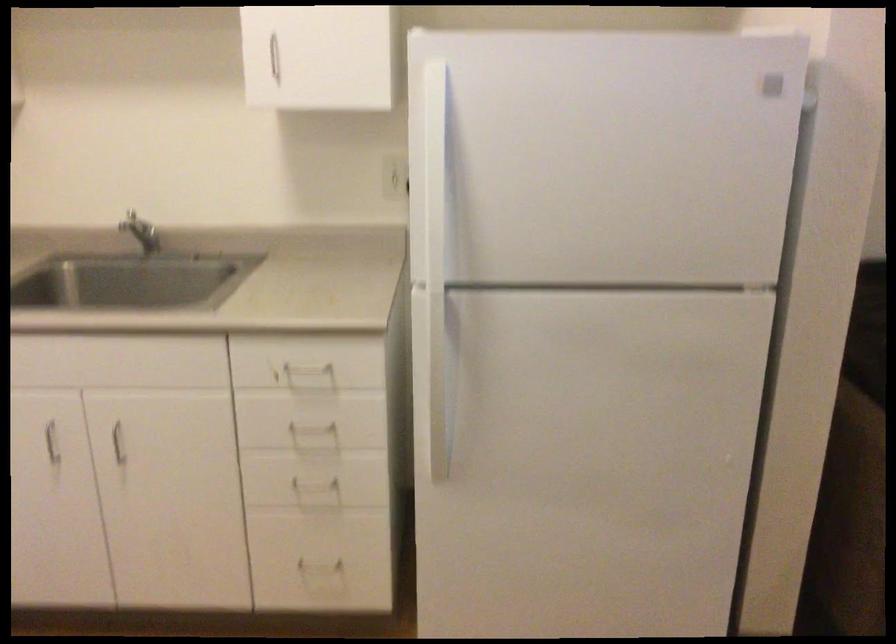
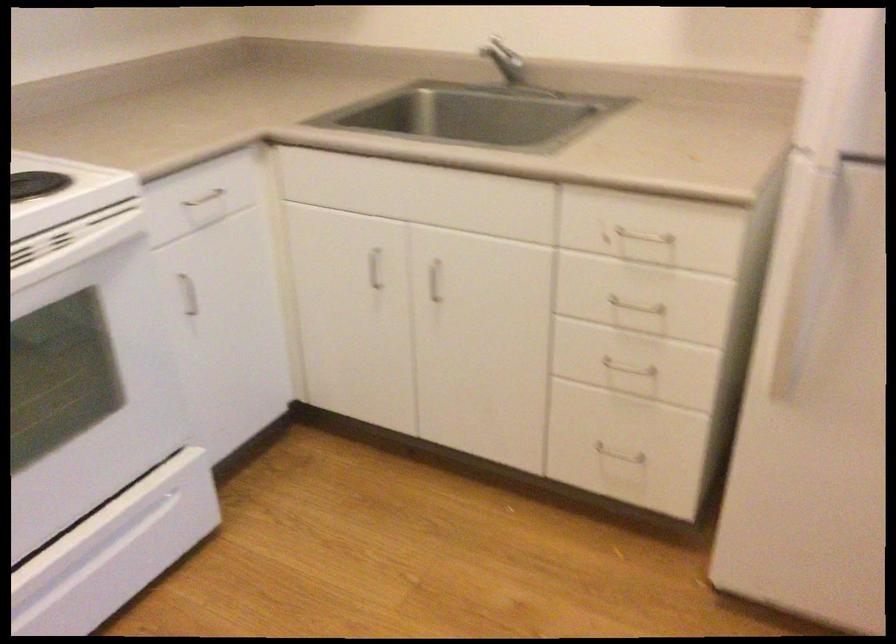
Where in the second image is the point corresponding to pixel 312 476 from the first image?

(624, 359)